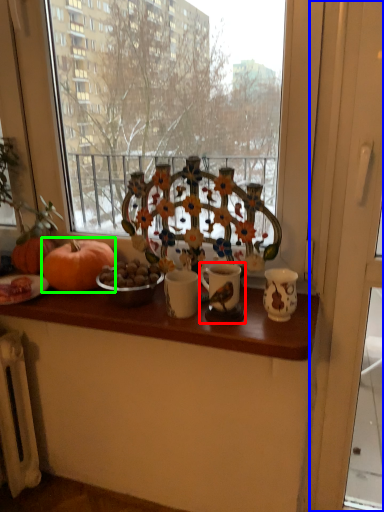
Question: Considering the real-world distances, which object is closest to candle holder (highlighted by a red box)? screen door (highlighted by a blue box) or pumpkin (highlighted by a green box).

Choices:
 (A) screen door
 (B) pumpkin

Answer: (B)